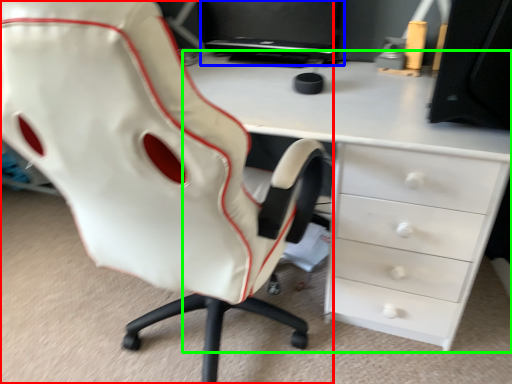
Question: Which object is the farthest from chair (highlighted by a red box)? Choose among these: computer monitor (highlighted by a blue box) or desk (highlighted by a green box).

Choices:
 (A) computer monitor
 (B) desk

Answer: (A)